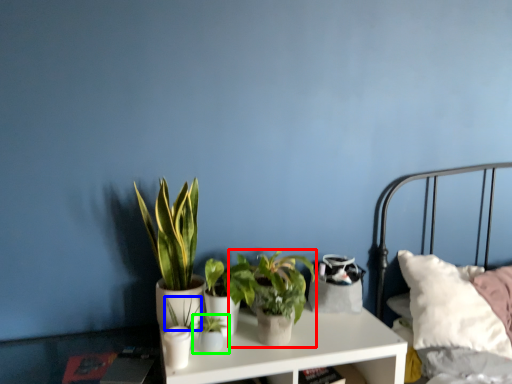
Question: Which object is the closest to the houseplant (highlighted by a red box)? Choose among these: plant (highlighted by a blue box) or houseplant (highlighted by a green box).

Choices:
 (A) plant
 (B) houseplant

Answer: (B)